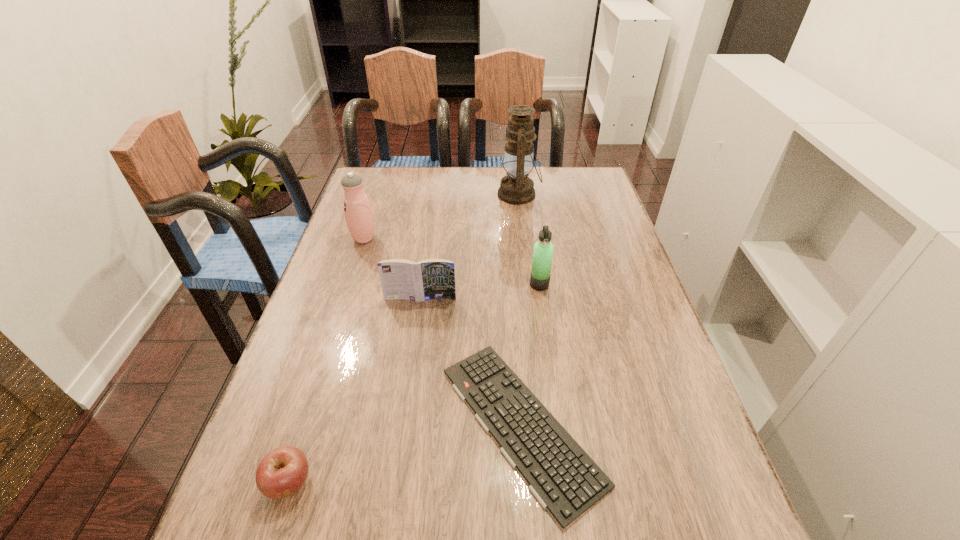
The height and width of the screenshot is (540, 960). I want to click on free space at the left edge, so click(331, 392).

You are a GUI agent. You are given a task and a screenshot of the screen. Output one action in this format:
    pyautogui.click(x=<x>, y=<y>)
    Task: Click on the vacant space at the right edge
    
    Given the screenshot: What is the action you would take?
    pyautogui.click(x=599, y=258)

Find the location of a particular element. vacant space at the far left corner of the desktop is located at coordinates (371, 183).

Where is `empty location between the fourth shortest object and the third shortest object`? empty location between the fourth shortest object and the third shortest object is located at coordinates (480, 292).

This screenshot has width=960, height=540. What are the coordinates of `vacant area that lies between the book and the oil lamp` in the screenshot? It's located at (469, 246).

Image resolution: width=960 pixels, height=540 pixels. I want to click on unoccupied position between the second shortest object and the computer keyboard, so click(x=405, y=454).

Where is `free point between the fifth nearest object and the computer keyboard`? This screenshot has height=540, width=960. free point between the fifth nearest object and the computer keyboard is located at coordinates (443, 332).

Locate an element on the screen. The height and width of the screenshot is (540, 960). vacant space that's between the right thermos bottle and the shortest object is located at coordinates (530, 354).

At what (x,y) coordinates should I click in order to perform the action: click on unoccupied position between the fourth tallest object and the third tallest object. Please return your answer as a coordinate pair (x, y). This screenshot has width=960, height=540. Looking at the image, I should click on (480, 292).

Identify which object is the third nearest to the book. Please provide its 2D coordinates. Your answer should be formatted as a tuple, i.e. [(x, y)], where the tuple contains the x and y coordinates of a point satisfying the conditions above.

[(359, 217)]